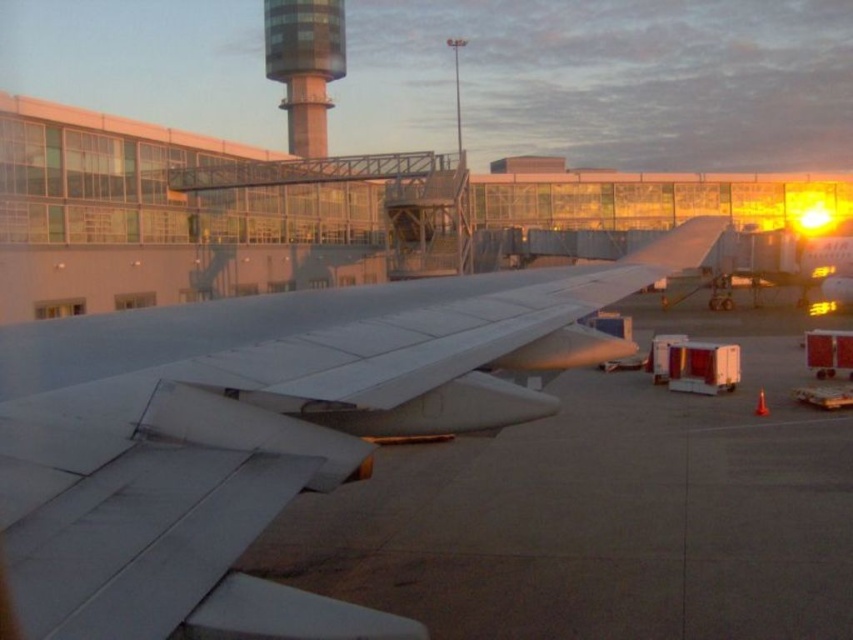
Does point (321, 145) lie behind point (50, 312)?

Yes.

Consider the image. Is glassy steel control tower at upper center positioned behind clear glass airplane window at center?

Yes, it is.

Is point (312, 118) behind point (48, 301)?

Yes, point (312, 118) is behind point (48, 301).

This screenshot has width=853, height=640. What are the coordinates of `glassy steel control tower at upper center` in the screenshot? It's located at (305, 65).

Which is above, white matte wing at center or clear glass airplane window at center?

clear glass airplane window at center is above.

In order to click on white matte wing at center in this screenshot , I will do `click(260, 432)`.

Does white matte wing at center appear under glassy steel control tower at upper center?

Indeed, white matte wing at center is positioned under glassy steel control tower at upper center.

Is white matte wing at center to the left of glassy steel control tower at upper center from the viewer's perspective?

Incorrect, white matte wing at center is not on the left side of glassy steel control tower at upper center.

Locate an element on the screen. The image size is (853, 640). white matte wing at center is located at coordinates (260, 432).

Where is `white matte wing at center`? white matte wing at center is located at coordinates (260, 432).